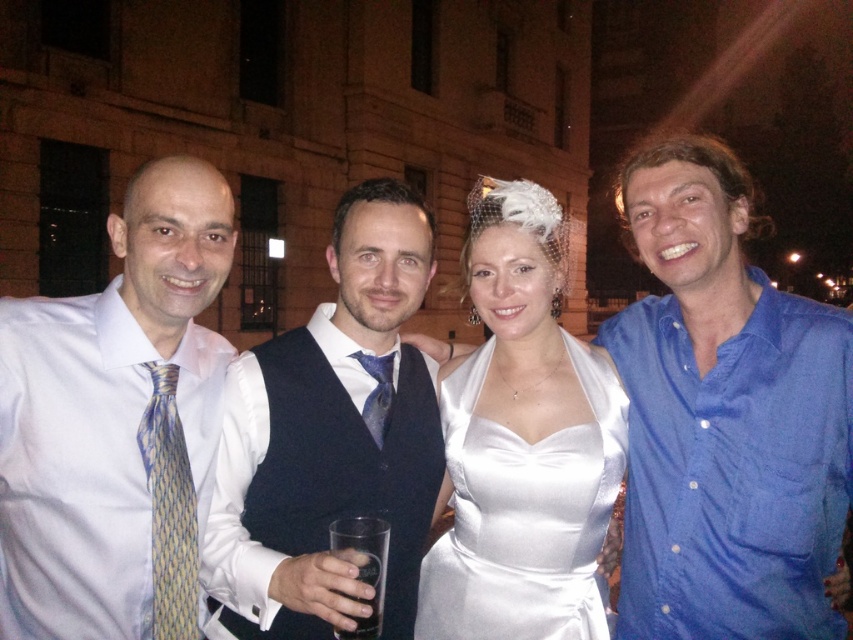
From the picture: You are standing at the point labeled as point (358, 548) in the image. You want to walk to the point labeled as point (505, 432). In which direction should you move relative to your current position?

You should move backward to reach point (505, 432) from point (358, 548) since it is behind your current position.